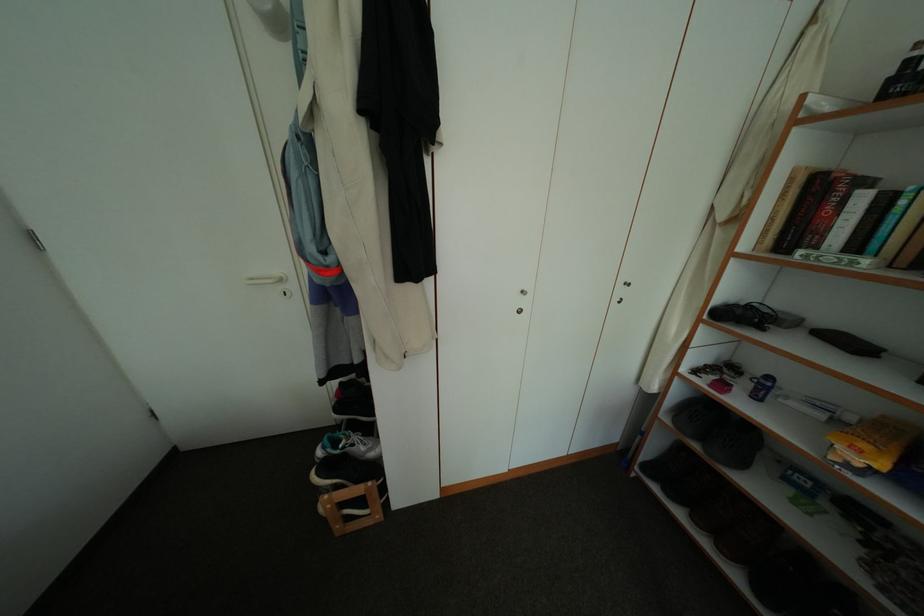
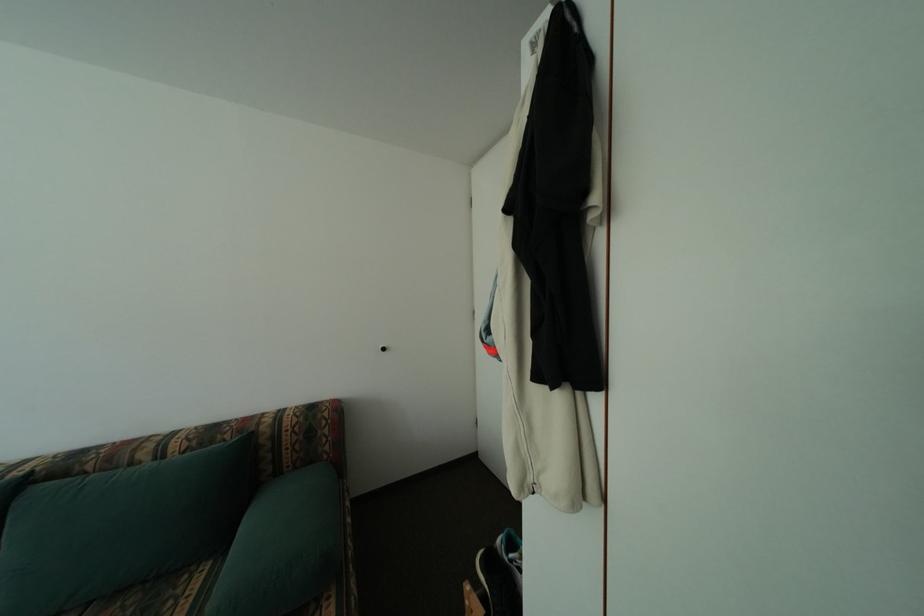
Question: Based on the continuous images, in which direction is the camera rotating? Reply with the corresponding letter.

Choices:
 (A) Left
 (B) Right
 (C) Up
 (D) Down

Answer: (A)